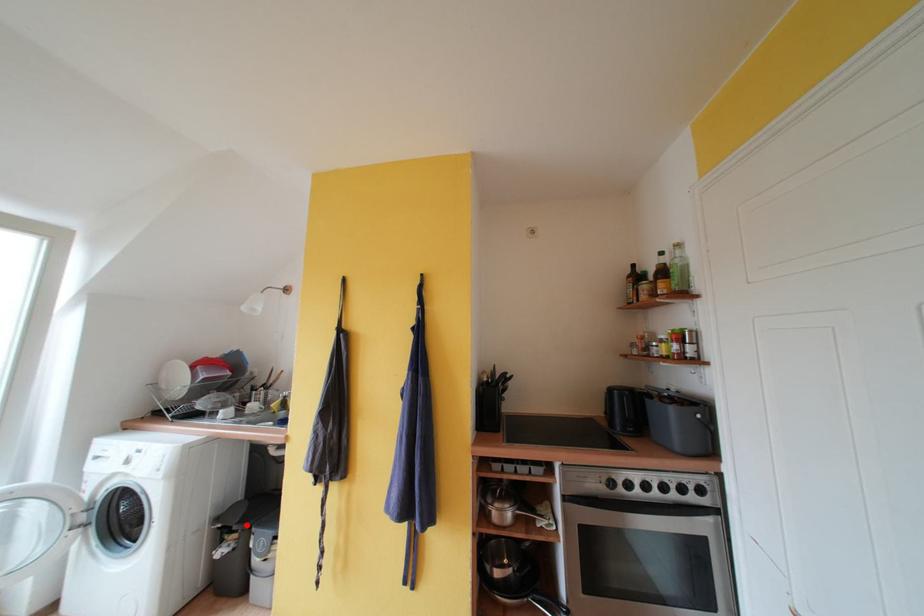
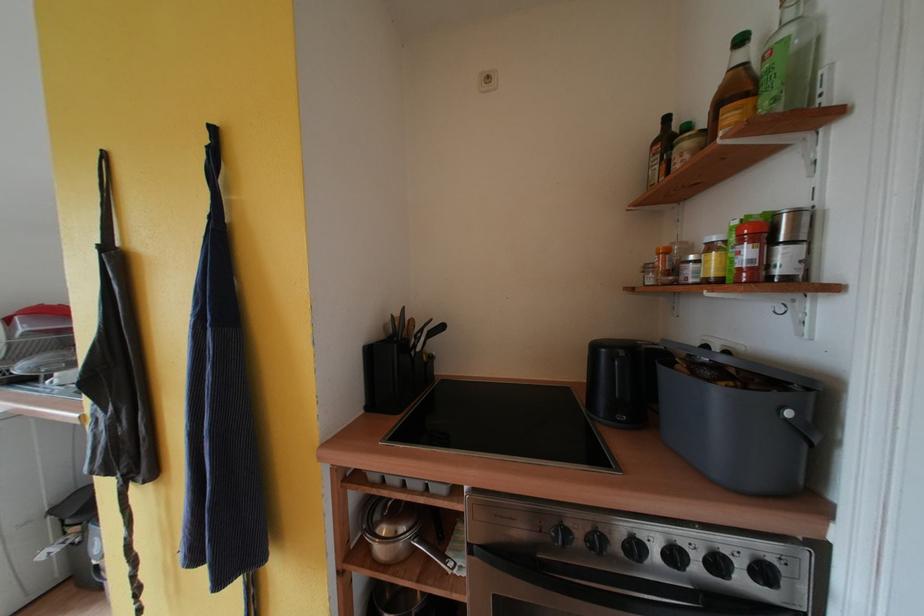
Question: I am providing you with two images of the same scene from different viewpoints. In image1, a red point is highlighted. Considering the same 3D point in image2, which of the following is correct?

Choices:
 (A) It is closer
 (B) It is farther

Answer: (A)